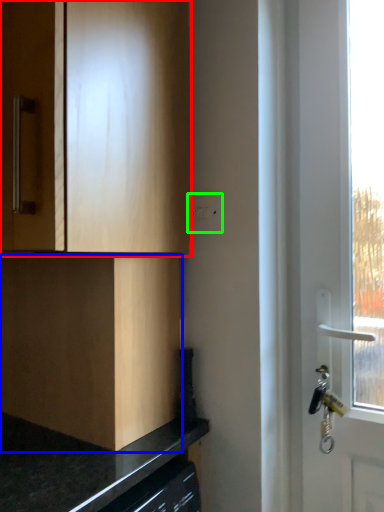
Question: Which is farther away from cabinetry (highlighted by a red box)? cabinetry (highlighted by a blue box) or electric outlet (highlighted by a green box)?

Choices:
 (A) cabinetry
 (B) electric outlet

Answer: (B)